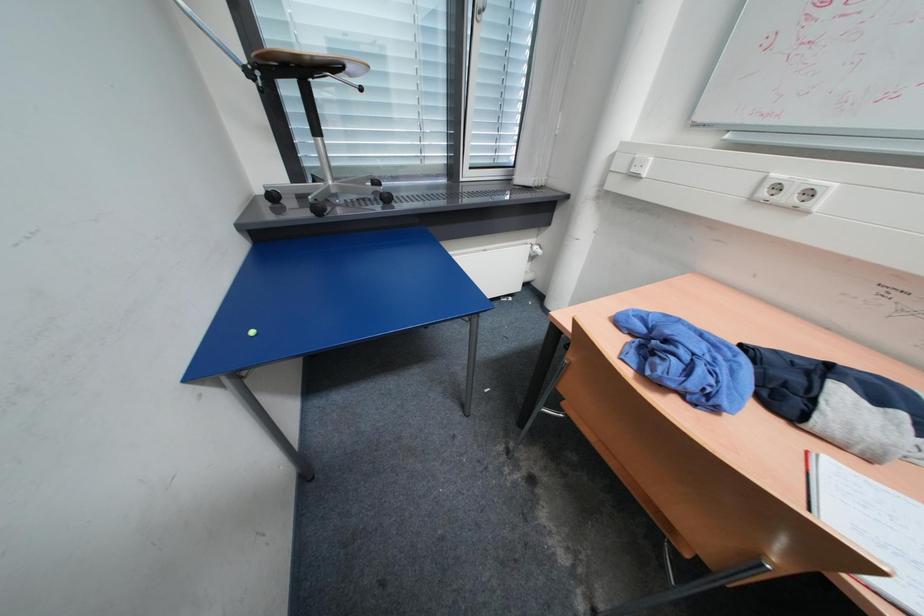
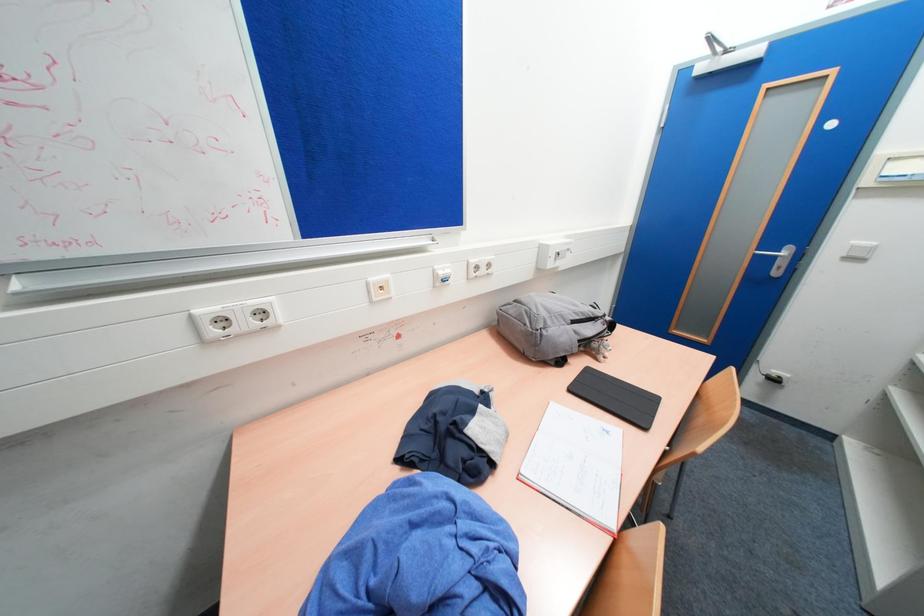
Based on the photo, how did the camera likely rotate?

The camera's rotation is toward right-down.